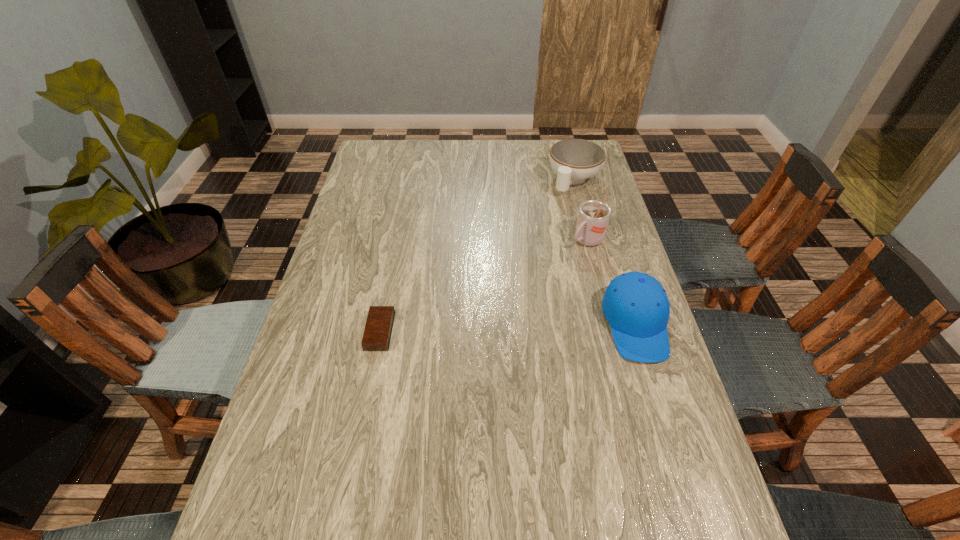
You are a GUI agent. You are given a task and a screenshot of the screen. Output one action in this format:
    pyautogui.click(x=<x>, y=<y>)
    Task: Click on the shortest object
    The width and height of the screenshot is (960, 540).
    Given the screenshot: What is the action you would take?
    pyautogui.click(x=377, y=334)

Find the location of `alarm clock`. alarm clock is located at coordinates (377, 334).

You are a GUI agent. You are given a task and a screenshot of the screen. Output one action in this format:
    pyautogui.click(x=<x>, y=<y>)
    Task: Click on the cap
    The height and width of the screenshot is (540, 960).
    Given the screenshot: What is the action you would take?
    pyautogui.click(x=636, y=306)

Locate an element on the screen. Image resolution: width=960 pixels, height=540 pixels. the third nearest object is located at coordinates (593, 216).

I want to click on cup, so click(x=593, y=216).

In order to click on chinaware in this screenshot , I will do `click(574, 160)`.

The image size is (960, 540). Identify the location of vacant space situated 0.140m on the front face of the shortest object. (314, 332).

Image resolution: width=960 pixels, height=540 pixels. In order to click on vacant position located on the front face of the shortest object in this screenshot , I will do `click(306, 332)`.

Find the location of a particular element. This screenshot has width=960, height=540. free space located on the front face of the shortest object is located at coordinates (345, 332).

Locate an element on the screen. The height and width of the screenshot is (540, 960). free space located 0.250m on the front-facing side of the cap is located at coordinates (681, 470).